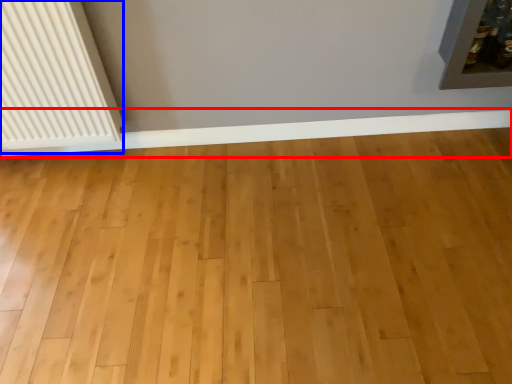
Question: Among these objects, which one is nearest to the camera, ledge (highlighted by a red box) or radiator (highlighted by a blue box)?

Choices:
 (A) ledge
 (B) radiator

Answer: (B)